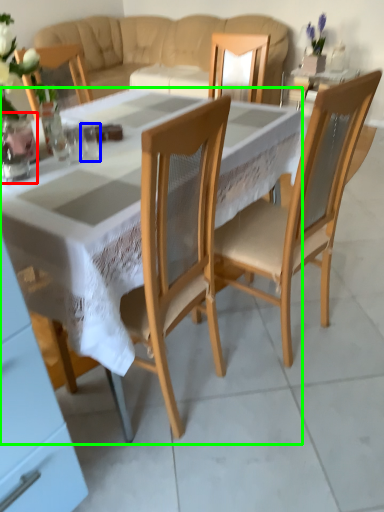
Question: Which object is positioned farthest from vase (highlighted by a red box)? Select from tableware (highlighted by a blue box) and desk (highlighted by a green box).

Choices:
 (A) tableware
 (B) desk

Answer: (B)